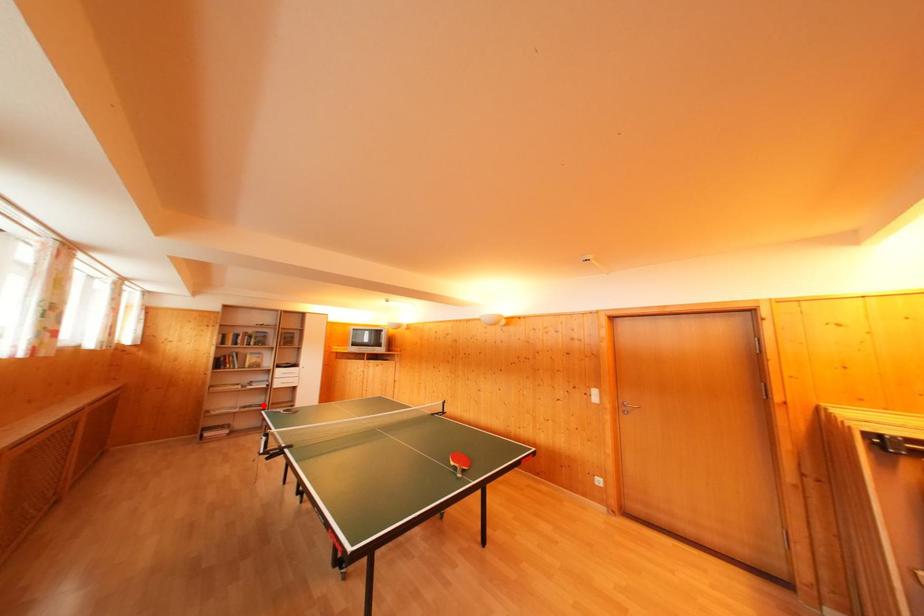
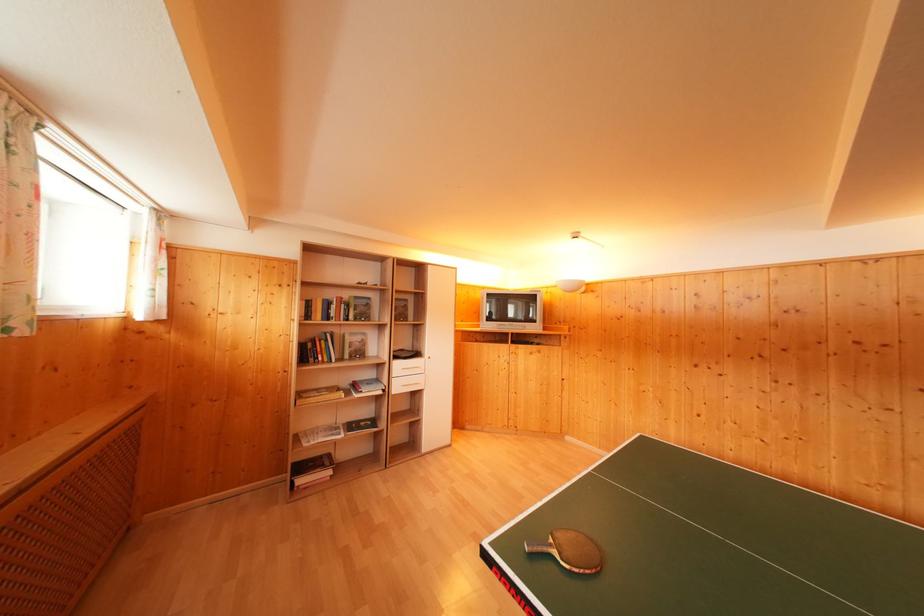
Question: I am providing you with two images of the same scene from different viewpoints. In image1, a red point is highlighted. Considering the same 3D point in image2, which of the following is correct?

Choices:
 (A) It is closer
 (B) It is farther

Answer: (B)